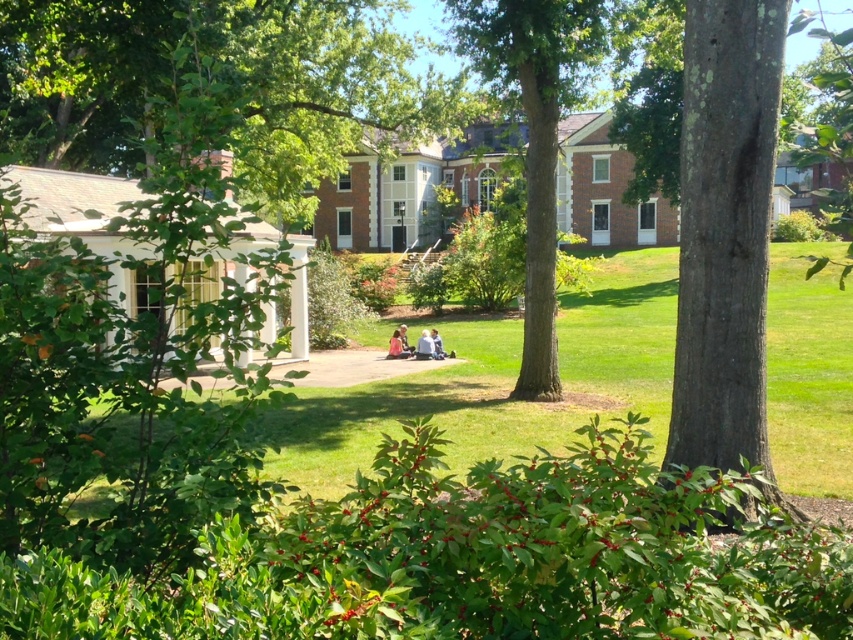
Question: Can you confirm if green leafy tree at center is positioned to the left of light blue denim jeans at center?

Choices:
 (A) no
 (B) yes

Answer: (B)

Question: Which object is positioned closest to the light brown leather jacket at center?

Choices:
 (A) light blue denim jeans at center
 (B) green leafy tree at center
 (C) green textured tree at center

Answer: (A)

Question: Does green textured tree at center have a larger size compared to light blue denim jeans at center?

Choices:
 (A) yes
 (B) no

Answer: (A)

Question: Does green leafy tree at center appear over light brown leather jacket at center?

Choices:
 (A) yes
 (B) no

Answer: (A)

Question: Based on their relative distances, which object is nearer to the light brown leather jacket at center?

Choices:
 (A) green leafy tree at center
 (B) light blue denim jeans at center
 (C) green textured tree at center

Answer: (B)

Question: Which is farther from the light brown leather jacket at center?

Choices:
 (A) smooth bark tree at center
 (B) green leafy tree at center

Answer: (B)